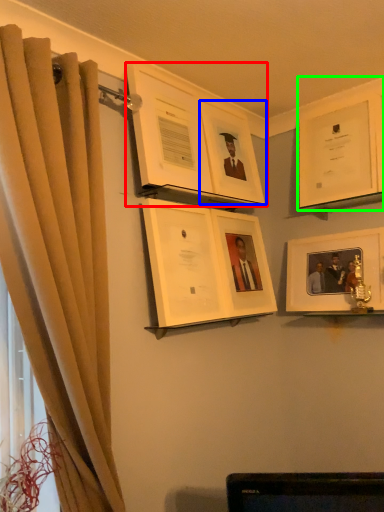
Question: Considering the real-world distances, which object is farthest from picture frame (highlighted by a red box)? picture frame (highlighted by a blue box) or picture frame (highlighted by a green box)?

Choices:
 (A) picture frame
 (B) picture frame

Answer: (B)